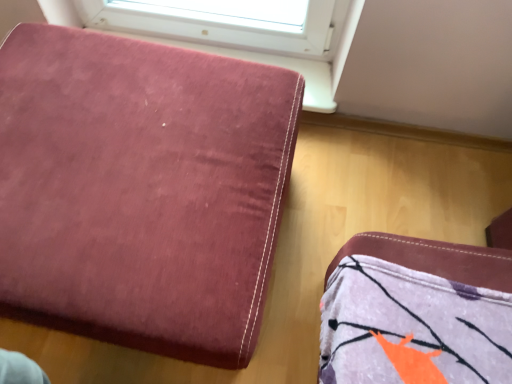
What do you see at coordinates (141, 190) in the screenshot? The width and height of the screenshot is (512, 384). I see `velvet-like burgundy ottoman at upper left` at bounding box center [141, 190].

What is the approximate height of velvet-like burgundy ottoman at upper left?

The height of velvet-like burgundy ottoman at upper left is 17.16 inches.

I want to click on velvet-like burgundy ottoman at upper left, so click(141, 190).

Find the location of `velvet-like burgundy ottoman at upper left`. velvet-like burgundy ottoman at upper left is located at coordinates (141, 190).